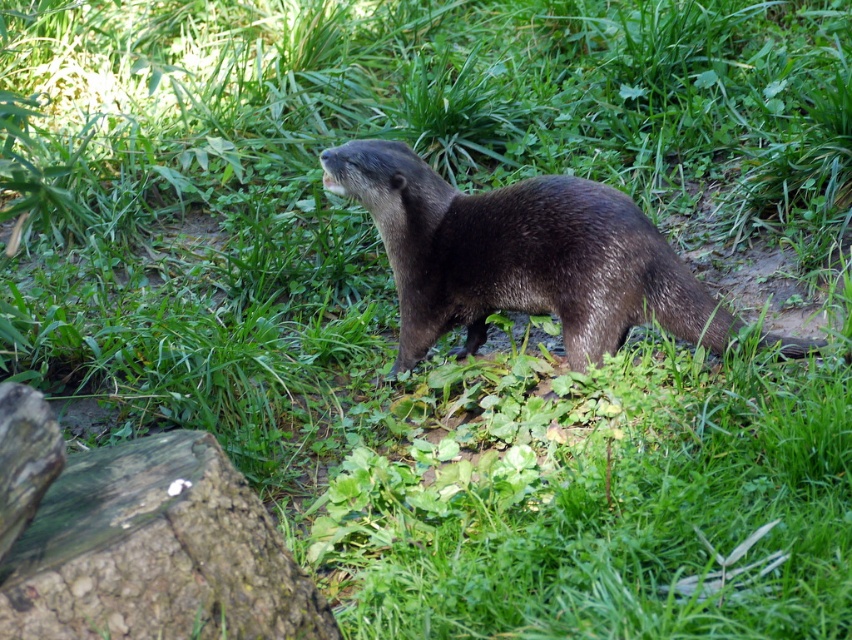
You are a wildlife photographer trying to capture the shiny brown otter at center and the weathered brown log at lower left in the same frame. Based on their sizes, which object will appear bigger in your photo?

The shiny brown otter at center will appear bigger in the photo because its width is larger than the weathered brown log at lower left.

Based on the photo, you are standing in a natural grassy area observing a river otter. There is a point at coordinate (579,202). If you want to place a small camera 2 meters away from that point to capture the otter, is the distance sufficient?

The point at coordinate (579,202) is 3.66 meters from the viewer. Placing a camera 2 meters away from that point would mean the camera is 1.66 meters away from the viewer, which is sufficient distance to capture the otter.

You are a nature photographer aiming to capture the shiny brown otter at center and the weathered brown log at lower left in the same frame. Based on their positions, which object is positioned more to the left?

Answer: The weathered brown log at lower left is positioned more to the left than the shiny brown otter at center.